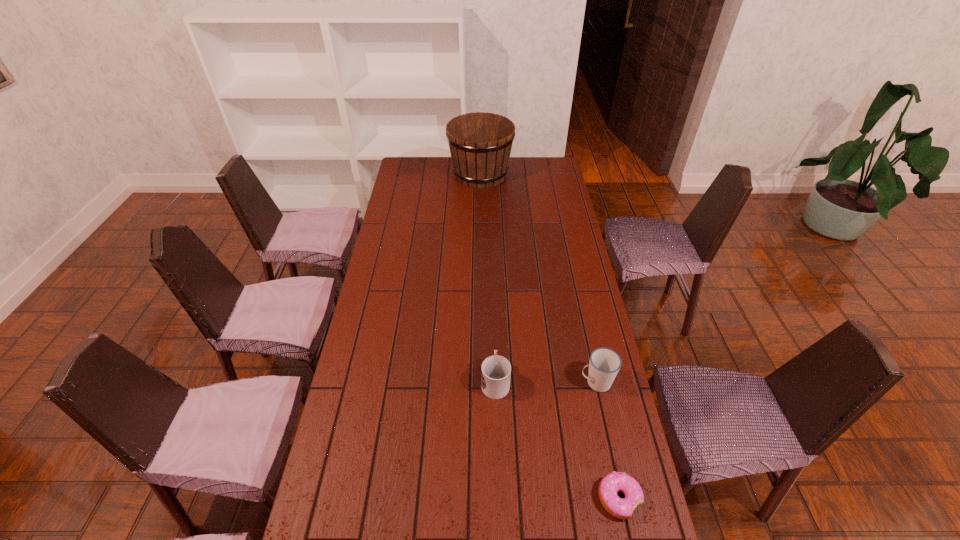
This screenshot has width=960, height=540. I want to click on the farthest object, so click(x=480, y=143).

Find the location of a particular element. wine bucket is located at coordinates (480, 143).

Locate an element on the screen. The width and height of the screenshot is (960, 540). the right cup is located at coordinates (604, 364).

Where is `the third tallest object`? the third tallest object is located at coordinates (496, 370).

You are a GUI agent. You are given a task and a screenshot of the screen. Output one action in this format:
    pyautogui.click(x=<x>, y=<y>)
    Task: Click on the shorter cup
    The width and height of the screenshot is (960, 540).
    Given the screenshot: What is the action you would take?
    pyautogui.click(x=496, y=370)

The width and height of the screenshot is (960, 540). In order to click on doughnut in this screenshot , I will do `click(611, 484)`.

Where is `the shortest object`? This screenshot has height=540, width=960. the shortest object is located at coordinates click(x=611, y=484).

The image size is (960, 540). Identify the location of free region located on the front of the tallest object. (481, 244).

The width and height of the screenshot is (960, 540). In order to click on free space located with a handle on the side of the right cup in this screenshot , I will do `click(468, 382)`.

The width and height of the screenshot is (960, 540). What are the coordinates of `free space located 0.200m with a handle on the side of the right cup` in the screenshot? It's located at (516, 382).